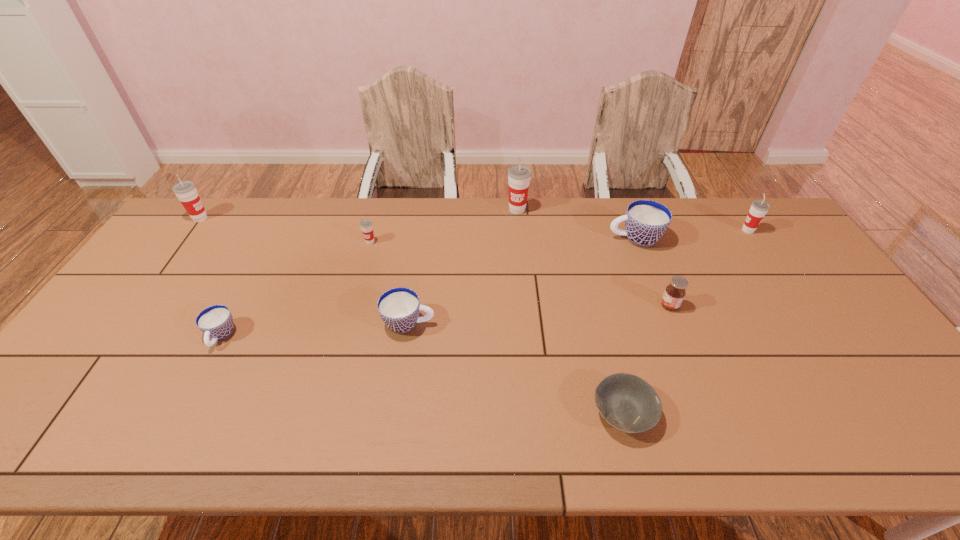
Identify the location of free space located on the side of the rightmost red cup with the logo. (631, 230).

The width and height of the screenshot is (960, 540). Identify the location of free space located 0.300m on the side of the rightmost red cup with the logo. (651, 230).

Image resolution: width=960 pixels, height=540 pixels. What are the coordinates of `free space located 0.260m on the side of the rightmost blue cup with the handle` in the screenshot? It's located at (529, 239).

The image size is (960, 540). I want to click on vacant space located on the side of the rightmost blue cup with the handle, so click(x=547, y=239).

Where is `vacant space located 0.330m on the side of the rightmost blue cup with the handle`? Image resolution: width=960 pixels, height=540 pixels. vacant space located 0.330m on the side of the rightmost blue cup with the handle is located at coordinates (508, 239).

Find the location of `free space located 0.250m on the side of the smallest red cup with the logo`. free space located 0.250m on the side of the smallest red cup with the logo is located at coordinates (353, 303).

You are a GUI agent. You are given a task and a screenshot of the screen. Output one action in this format:
    pyautogui.click(x=<x>, y=<y>)
    Task: Click on the vacant region located on the label side of the jam
    
    Given the screenshot: What is the action you would take?
    pyautogui.click(x=583, y=306)

Find the location of `vacant space situated 0.300m on the label side of the jam`. vacant space situated 0.300m on the label side of the jam is located at coordinates (554, 306).

Identify the location of free location located 0.360m on the label side of the jam. (533, 306).

Where is `vacant region located on the side of the second shortest cup with the handle`? The width and height of the screenshot is (960, 540). vacant region located on the side of the second shortest cup with the handle is located at coordinates (512, 323).